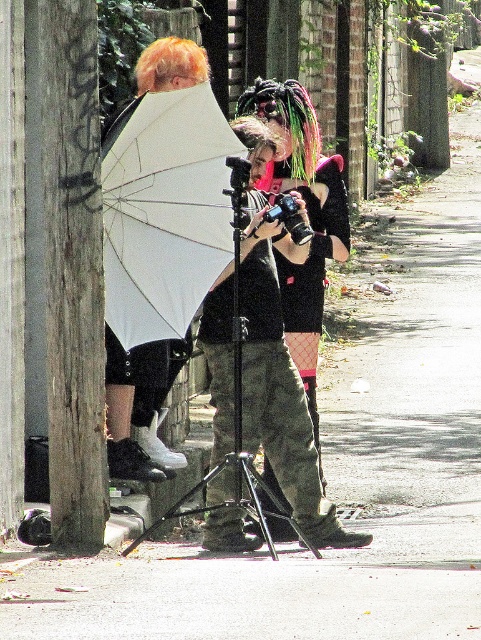
You are a photographer setting up a shot in the described scene. You need to adjust the matte black tripod at center so it doesn not block the weathered wood pole at left. Which direction should you move it?

The matte black tripod at center is currently behind the weathered wood pole at left. To prevent blocking it, move the matte black tripod at center forward so it is in front of the weathered wood pole at left.